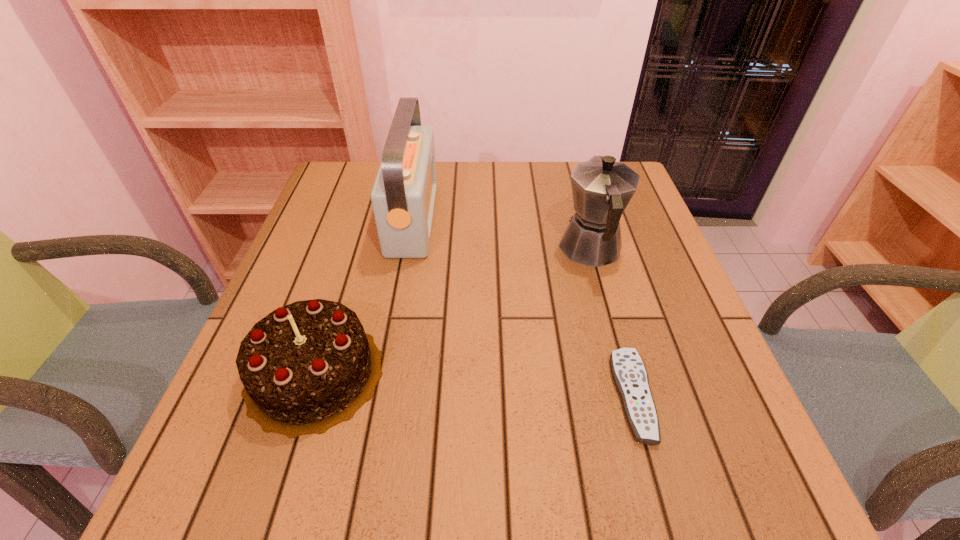
Locate an element on the screen. This screenshot has width=960, height=540. object that is the second closest one to the shortest object is located at coordinates (307, 366).

You are a GUI agent. You are given a task and a screenshot of the screen. Output one action in this format:
    pyautogui.click(x=<x>, y=<y>)
    Task: Click on the vacant space that satisfies the following two spatial constraints: 1. on the front-facing side of the radio receiver; 2. on the front side of the birthday cake
    
    Given the screenshot: What is the action you would take?
    pyautogui.click(x=384, y=373)

The width and height of the screenshot is (960, 540). I want to click on free point that satisfies the following two spatial constraints: 1. on the front-facing side of the radio receiver; 2. at the spout of the coffeepot, so click(x=407, y=249).

Locate an element on the screen. free region that satisfies the following two spatial constraints: 1. on the front-facing side of the radio receiver; 2. at the spout of the coffeepot is located at coordinates (407, 249).

Where is `vacant space that satisfies the following two spatial constraints: 1. on the front side of the shortest object; 2. on the left side of the second shortest object`? The height and width of the screenshot is (540, 960). vacant space that satisfies the following two spatial constraints: 1. on the front side of the shortest object; 2. on the left side of the second shortest object is located at coordinates (307, 396).

The width and height of the screenshot is (960, 540). I want to click on vacant space that satisfies the following two spatial constraints: 1. on the front-facing side of the radio receiver; 2. at the spout of the coffeepot, so click(407, 249).

I want to click on vacant area that satisfies the following two spatial constraints: 1. on the front-facing side of the radio receiver; 2. at the spout of the coffeepot, so [407, 249].